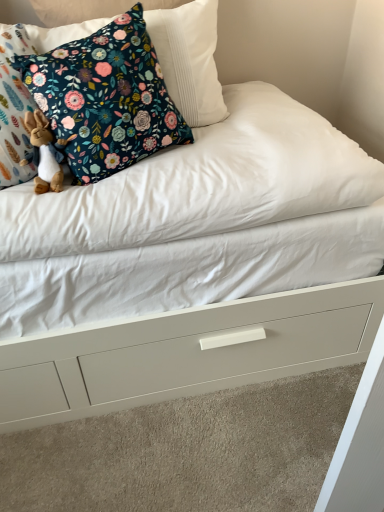
This screenshot has height=512, width=384. Describe the element at coordinates (44, 153) in the screenshot. I see `brown plush rabbit at left` at that location.

Measure the distance between point (41,153) and camera.

The distance of point (41,153) from camera is 3.51 feet.

Measure the distance between point (13, 64) and camera.

Point (13, 64) and camera are 1.05 meters apart from each other.

This screenshot has height=512, width=384. Identify the location of brown plush rabbit at left. (44, 153).

From the image's perspective, does floral fabric pillow at upper left appear higher than brown plush rabbit at left?

Yes.

Looking at this image, does floral fabric pillow at upper left lie in front of brown plush rabbit at left?

Yes, floral fabric pillow at upper left is in front of brown plush rabbit at left.

Does floral fabric pillow at upper left have a greater width compared to brown plush rabbit at left?

Indeed, floral fabric pillow at upper left has a greater width compared to brown plush rabbit at left.

Considering the relative sizes of floral fabric pillow at upper left and brown plush rabbit at left in the image provided, is floral fabric pillow at upper left taller than brown plush rabbit at left?

Indeed, floral fabric pillow at upper left has a greater height compared to brown plush rabbit at left.

Which of these two, white matte drawer at center or brown plush rabbit at left, stands taller?

brown plush rabbit at left is taller.

Is brown plush rabbit at left a part of white matte drawer at center?

No, brown plush rabbit at left is located outside of white matte drawer at center.

How different are the orientations of white matte drawer at center and brown plush rabbit at left in degrees?

white matte drawer at center and brown plush rabbit at left are facing 88.7 degrees away from each other.

From the image's perspective, is white matte drawer at center located above brown plush rabbit at left?

No, from the image's perspective, white matte drawer at center is not above brown plush rabbit at left.

Does white matte drawer at center have a lesser height compared to floral fabric pillow at upper left?

Yes, white matte drawer at center is shorter than floral fabric pillow at upper left.

Is white matte drawer at center placed right next to floral fabric pillow at upper left?

No, white matte drawer at center is not touching floral fabric pillow at upper left.

From the image's perspective, is white matte drawer at center located above floral fabric pillow at upper left?

No.

In the image, is floral fabric pillow at upper left on the left side or the right side of white matte drawer at center?

From the image, it's evident that floral fabric pillow at upper left is to the left of white matte drawer at center.

Considering their positions, is floral fabric pillow at upper left located in front of or behind white matte drawer at center?

floral fabric pillow at upper left is in front of white matte drawer at center.

From a real-world perspective, who is located higher, floral fabric pillow at upper left or white matte drawer at center?

From a 3D spatial view, floral fabric pillow at upper left is above.

Locate an element on the screen. pillow above the white matte drawer at center (from a real-world perspective) is located at coordinates (105, 98).

Based on the photo, is brown plush rabbit at left touching white matte drawer at center?

brown plush rabbit at left is not next to white matte drawer at center, and they're not touching.

Which of these two, brown plush rabbit at left or white matte drawer at center, is smaller?

Smaller between the two is brown plush rabbit at left.

How distant is brown plush rabbit at left from white matte drawer at center?

brown plush rabbit at left and white matte drawer at center are 67.20 centimeters apart.

From a real-world perspective, which is physically above, brown plush rabbit at left or white matte drawer at center?

brown plush rabbit at left is physically above.

Is point (24, 125) behind point (85, 51)?

Yes, point (24, 125) is farther from viewer.

In terms of height, does brown plush rabbit at left look taller or shorter compared to floral fabric pillow at upper left?

Considering their sizes, brown plush rabbit at left has less height than floral fabric pillow at upper left.

Locate an element on the screen. pillow above the brown plush rabbit at left (from a real-world perspective) is located at coordinates (105, 98).

The height and width of the screenshot is (512, 384). I want to click on toy below the floral fabric pillow at upper left (from a real-world perspective), so click(44, 153).

Find the location of `toy that appears above the white matte drawer at center (from the image's perspective)`. toy that appears above the white matte drawer at center (from the image's perspective) is located at coordinates (44, 153).

Looking at the image, which one is located further to brown plush rabbit at left, white matte drawer at center or floral fabric pillow at upper left?

Among the two, white matte drawer at center is located further to brown plush rabbit at left.

Based on their spatial positions, is brown plush rabbit at left or floral fabric pillow at upper left further from white matte drawer at center?

Among the two, brown plush rabbit at left is located further to white matte drawer at center.

When comparing their distances from floral fabric pillow at upper left, does brown plush rabbit at left or white matte drawer at center seem further?

Based on the image, white matte drawer at center appears to be further to floral fabric pillow at upper left.

From the image, which object appears to be farther from floral fabric pillow at upper left, white matte drawer at center or brown plush rabbit at left?

Among the two, white matte drawer at center is located further to floral fabric pillow at upper left.

Based on their spatial positions, is floral fabric pillow at upper left or white matte drawer at center closer to brown plush rabbit at left?

floral fabric pillow at upper left lies closer to brown plush rabbit at left than the other object.

From the image, which object appears to be nearer to white matte drawer at center, floral fabric pillow at upper left or brown plush rabbit at left?

Based on the image, floral fabric pillow at upper left appears to be nearer to white matte drawer at center.

Where is `toy between floral fabric pillow at upper left and white matte drawer at center in the vertical direction`? The width and height of the screenshot is (384, 512). toy between floral fabric pillow at upper left and white matte drawer at center in the vertical direction is located at coordinates (44, 153).